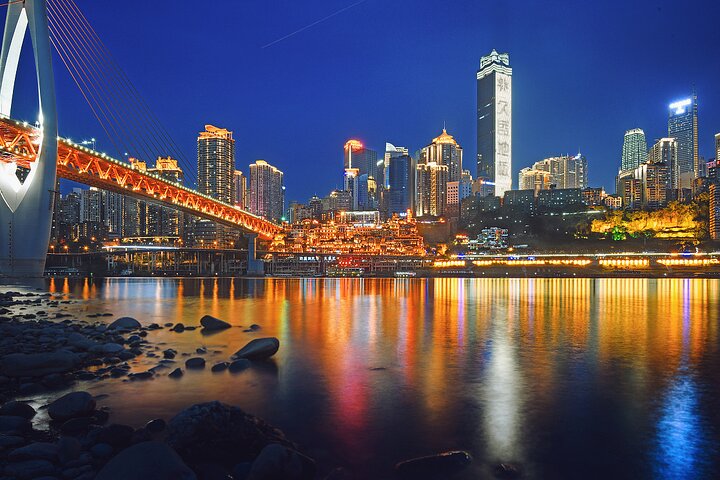
Identify the location of light. pyautogui.click(x=498, y=384).